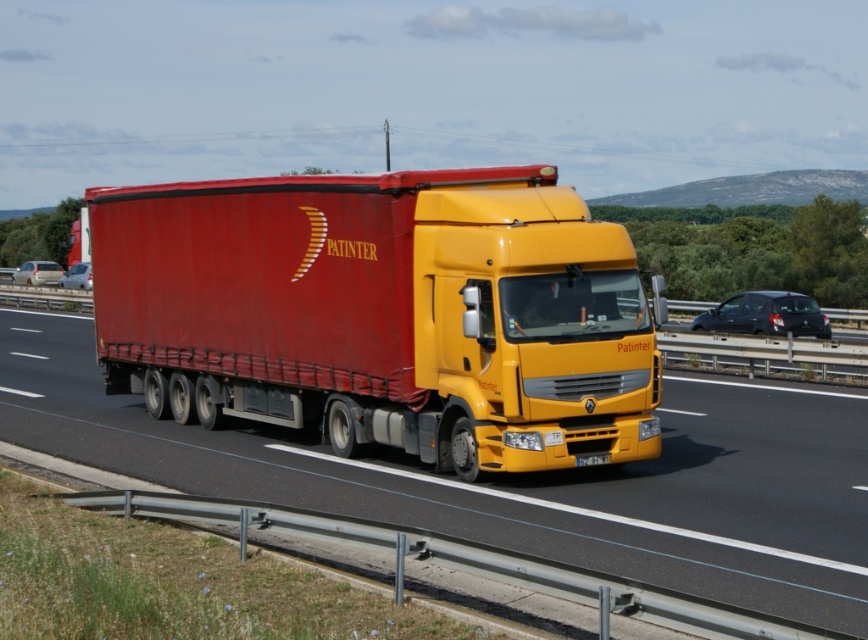
Question: From the image, what is the correct spatial relationship of matte red trailer truck at center in relation to metallic silver sedan at left?

Choices:
 (A) right
 (B) left

Answer: (A)

Question: Does matte red trailer truck at center have a lesser width compared to metallic silver sedan at left?

Choices:
 (A) no
 (B) yes

Answer: (B)

Question: Among these objects, which one is nearest to the camera?

Choices:
 (A) matte red trailer truck at center
 (B) yellow matte license plate at center

Answer: (A)

Question: Which object is the closest to the yellow matte truck at center?

Choices:
 (A) silver metallic sedan at left
 (B) yellow matte license plate at center

Answer: (B)

Question: Considering the real-world distances, which object is closest to the metallic silver sedan at left?

Choices:
 (A) yellow matte license plate at center
 (B) silver metallic sedan at left
 (C) matte black car at right
 (D) matte red trailer truck at center

Answer: (B)

Question: Considering the relative positions of yellow matte truck at center and metallic silver sedan at left in the image provided, where is yellow matte truck at center located with respect to metallic silver sedan at left?

Choices:
 (A) right
 (B) left

Answer: (A)